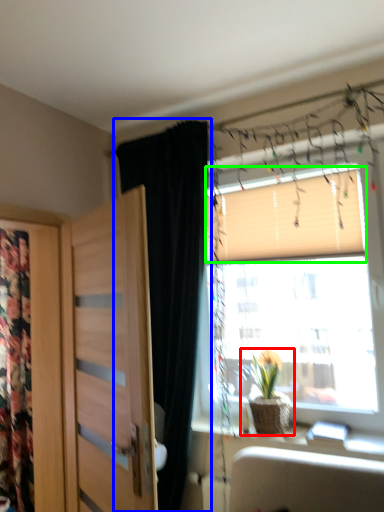
Question: Which is farther away from houseplant (highlighted by a red box)? curtain (highlighted by a blue box) or blind (highlighted by a green box)?

Choices:
 (A) curtain
 (B) blind

Answer: (B)